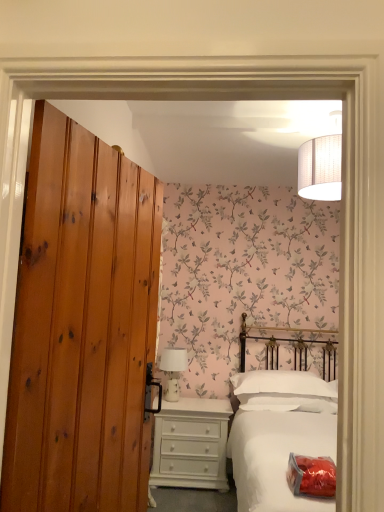
You are a GUI agent. You are given a task and a screenshot of the screen. Output one action in this format:
    pyautogui.click(x=<x>, y=<y>)
    Task: Click on the white painted wood chest of drawers at lower center
    
    Given the screenshot: What is the action you would take?
    (x=191, y=444)

The height and width of the screenshot is (512, 384). What do you see at coordinates (173, 370) in the screenshot?
I see `white ceramic table lamp at center` at bounding box center [173, 370].

You are a GUI agent. You are given a task and a screenshot of the screen. Output one action in this format:
    pyautogui.click(x=<x>, y=<y>)
    Task: Click on the white soft pillow at center
    Image resolution: width=384 pixels, height=512 pixels.
    Given the screenshot: What is the action you would take?
    click(284, 391)

The height and width of the screenshot is (512, 384). Describe the element at coordinates (284, 391) in the screenshot. I see `white soft pillow at center` at that location.

Describe the element at coordinates (278, 430) in the screenshot. This screenshot has height=512, width=384. I see `white matte bed at center` at that location.

Find the location of a particular element. The image size is (384, 512). white painted wood chest of drawers at lower center is located at coordinates (191, 444).

Can you confirm if white matte bed at center is shorter than knotty pine door at left?

No, white matte bed at center is not shorter than knotty pine door at left.

Does white matte bed at center have a larger size compared to knotty pine door at left?

Correct, white matte bed at center is larger in size than knotty pine door at left.

Is white matte bed at center positioned behind knotty pine door at left?

That is True.

From the image's perspective, is white matte bed at center on knotty pine door at left?

No, from the image's perspective, white matte bed at center is not on top of knotty pine door at left.

Looking at this image, between knotty pine door at left and white matte bed at center, which one has less height?

With less height is knotty pine door at left.

Considering the relative sizes of knotty pine door at left and white matte bed at center in the image provided, is knotty pine door at left bigger than white matte bed at center?

No, knotty pine door at left is not bigger than white matte bed at center.

Which object is more forward, knotty pine door at left or white matte bed at center?

knotty pine door at left is closer to the camera.

From the image's perspective, between knotty pine door at left and white matte bed at center, who is located below?

white matte bed at center appears lower in the image.

Considering the positions of objects white ceramic table lamp at center and white matte bed at center in the image provided, who is more to the right, white ceramic table lamp at center or white matte bed at center?

white matte bed at center is more to the right.

From a real-world perspective, is white ceramic table lamp at center located higher than white matte bed at center?

Correct, in the physical world, white ceramic table lamp at center is higher than white matte bed at center.

How much distance is there between white ceramic table lamp at center and white matte bed at center?

36.50 inches.

Is white ceramic table lamp at center taller or shorter than white matte bed at center?

Clearly, white ceramic table lamp at center is shorter compared to white matte bed at center.

Consider the image. Which of these two, white matte bed at center or white soft pillow at center, stands taller?

Standing taller between the two is white matte bed at center.

Based on their sizes in the image, would you say white matte bed at center is bigger or smaller than white soft pillow at center?

Clearly, white matte bed at center is larger in size than white soft pillow at center.

In the scene shown: Would you say white matte bed at center is inside or outside white soft pillow at center?

white matte bed at center exists outside the volume of white soft pillow at center.

Which is in front, white matte bed at center or white soft pillow at center?

white matte bed at center is more forward.

From a real-world perspective, is knotty pine door at left located higher than white painted wood chest of drawers at lower center?

Yes, from a real-world perspective, knotty pine door at left is over white painted wood chest of drawers at lower center

Based on the photo, is the position of knotty pine door at left more distant than that of white painted wood chest of drawers at lower center?

That is False.

From the image's perspective, between knotty pine door at left and white painted wood chest of drawers at lower center, which one is located above?

knotty pine door at left is shown above in the image.

From the image's perspective, would you say knotty pine door at left is positioned over white ceramic table lamp at center?

Yes, from the image's perspective, knotty pine door at left is on top of white ceramic table lamp at center.

Considering the relative positions of knotty pine door at left and white ceramic table lamp at center in the image provided, is knotty pine door at left in front of white ceramic table lamp at center?

Yes, it is in front of white ceramic table lamp at center.

Is knotty pine door at left far from white ceramic table lamp at center?

Yes, knotty pine door at left and white ceramic table lamp at center are quite far apart.

I want to click on pillow lying on the right of knotty pine door at left, so click(284, 391).

What's the angular difference between white soft pillow at center and knotty pine door at left's facing directions?

The angle between the facing direction of white soft pillow at center and the facing direction of knotty pine door at left is 68.5 degrees.

Considering the relative positions of white soft pillow at center and knotty pine door at left in the image provided, is white soft pillow at center to the left or to the right of knotty pine door at left?

Clearly, white soft pillow at center is on the right of knotty pine door at left in the image.

Considering the positions of point (293, 397) and point (28, 260), is point (293, 397) closer or farther from the camera than point (28, 260)?

Clearly, point (293, 397) is more distant from the camera than point (28, 260).

Find the location of a particular element. The height and width of the screenshot is (512, 384). door in front of the white matte bed at center is located at coordinates (82, 326).

Where is `door to the left of white matte bed at center`? door to the left of white matte bed at center is located at coordinates (82, 326).

From the image, which object appears to be nearer to white matte bed at center, white soft pillow at center or white painted wood chest of drawers at lower center?

white soft pillow at center.

When comparing their distances from white soft pillow at center, does white matte bed at center or white ceramic table lamp at center seem closer?

white matte bed at center.

When comparing their distances from white matte bed at center, does white painted wood chest of drawers at lower center or white soft pillow at center seem further?

white painted wood chest of drawers at lower center lies further to white matte bed at center than the other object.

Which object lies further to the anchor point knotty pine door at left, white painted wood chest of drawers at lower center or white ceramic table lamp at center?

Among the two, white ceramic table lamp at center is located further to knotty pine door at left.

Looking at the image, which one is located closer to white soft pillow at center, white painted wood chest of drawers at lower center or knotty pine door at left?

white painted wood chest of drawers at lower center is positioned closer to the anchor white soft pillow at center.

Based on their spatial positions, is white painted wood chest of drawers at lower center or white soft pillow at center further from white ceramic table lamp at center?

Based on the image, white soft pillow at center appears to be further to white ceramic table lamp at center.

Which object lies nearer to the anchor point white soft pillow at center, white ceramic table lamp at center or knotty pine door at left?

Based on the image, white ceramic table lamp at center appears to be nearer to white soft pillow at center.

Considering their positions, is knotty pine door at left positioned closer to white soft pillow at center than white ceramic table lamp at center?

Based on the image, white ceramic table lamp at center appears to be nearer to white soft pillow at center.

Find the location of a particular element. The height and width of the screenshot is (512, 384). pillow between knotty pine door at left and white ceramic table lamp at center from front to back is located at coordinates pos(284,391).

Locate an element on the screen. This screenshot has width=384, height=512. bed between knotty pine door at left and white soft pillow at center in the front-back direction is located at coordinates (278, 430).

Identify the location of chest of drawers between knotty pine door at left and white ceramic table lamp at center along the z-axis. (191, 444).

Image resolution: width=384 pixels, height=512 pixels. What are the coordinates of `bed between knotty pine door at left and white painted wood chest of drawers at lower center in the front-back direction` in the screenshot? It's located at (278, 430).